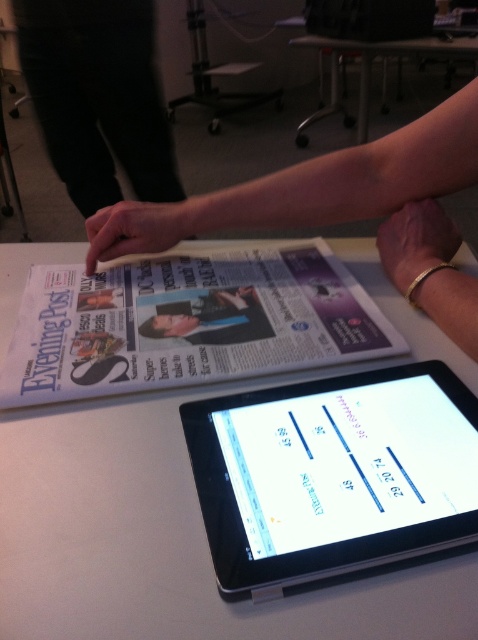
Question: Which object is the closest to the black glossy tablet at center?

Choices:
 (A) smooth skin at upper center
 (B) white plastic table at upper center
 (C) gold bracelet at upper right

Answer: (C)

Question: Can you confirm if white glossy newspaper at upper center is positioned to the left of gold bracelet at upper right?

Choices:
 (A) no
 (B) yes

Answer: (B)

Question: Which point is farther to the camera?

Choices:
 (A) (451, 385)
 (B) (145, 244)
 (C) (455, 243)
 (D) (224, 324)

Answer: (B)

Question: Which point is farther from the camera taking this photo?

Choices:
 (A) (215, 301)
 (B) (476, 58)

Answer: (B)

Question: Considering the relative positions of white glossy newspaper at upper center and gold bracelet at upper right in the image provided, where is white glossy newspaper at upper center located with respect to gold bracelet at upper right?

Choices:
 (A) left
 (B) right

Answer: (A)

Question: Can you confirm if smooth skin at upper center is bigger than matte black jacket at center?

Choices:
 (A) yes
 (B) no

Answer: (A)